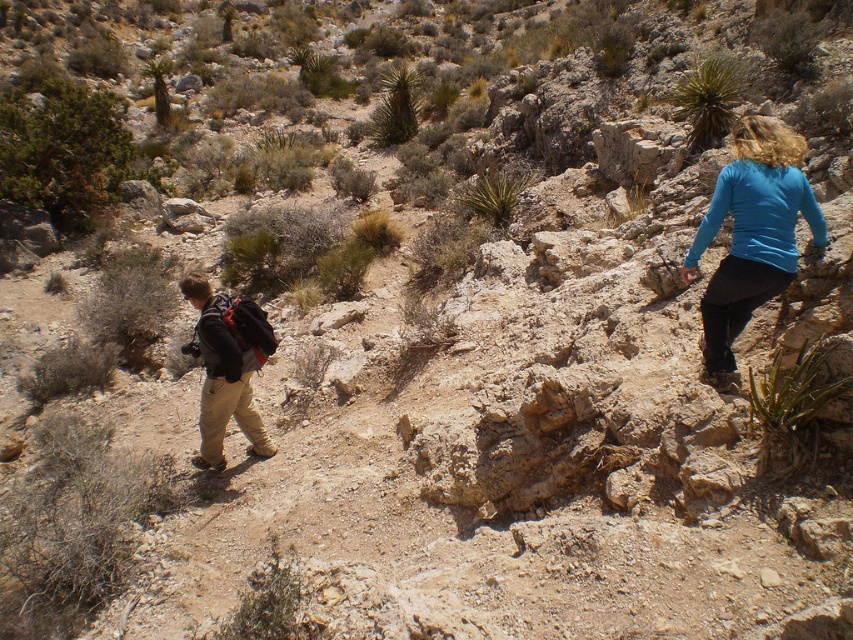
In the scene shown: You are a hiker trying to navigate the rocky terrain in the desert. You see a green shrub at upper left and a green spiky plant at upper right. Which plant is closer to the camera?

The green shrub at upper left is positioned over the green spiky plant at upper right, meaning it is closer to the camera.

You are a hiker carrying a 1.5 meter long tent pole. You want to place the tent pole horizontally on the ground near the green shrub at upper left. Considering the shrub is 16.51 meters away from you, will the tent pole fit entirely within the space between you and the shrub?

The green shrub at upper left is 16.51 meters away from the camera. Since the tent pole is only 1.5 meters long, it will easily fit within the space between you and the shrub as the distance is much greater than the pole length.